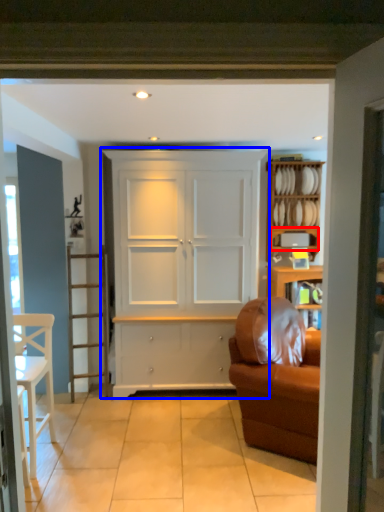
Question: Among these objects, which one is nearest to the camera, shelf (highlighted by a red box) or cupboard (highlighted by a blue box)?

Choices:
 (A) shelf
 (B) cupboard

Answer: (B)